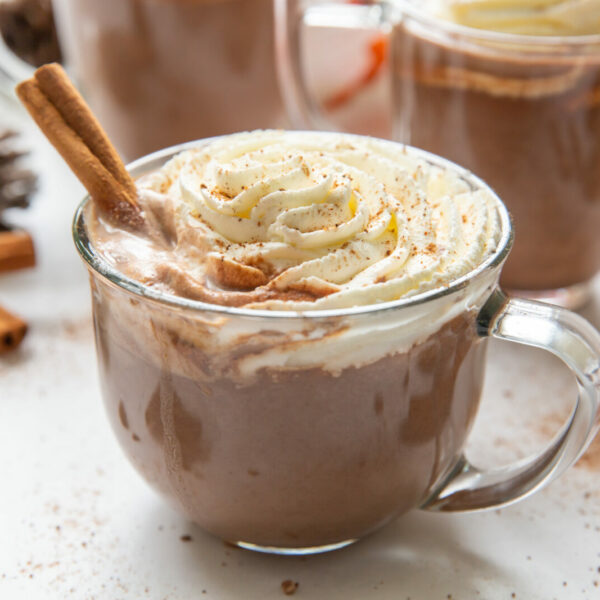
This screenshot has width=600, height=600. In order to click on handle in this screenshot , I will do `click(295, 90)`.